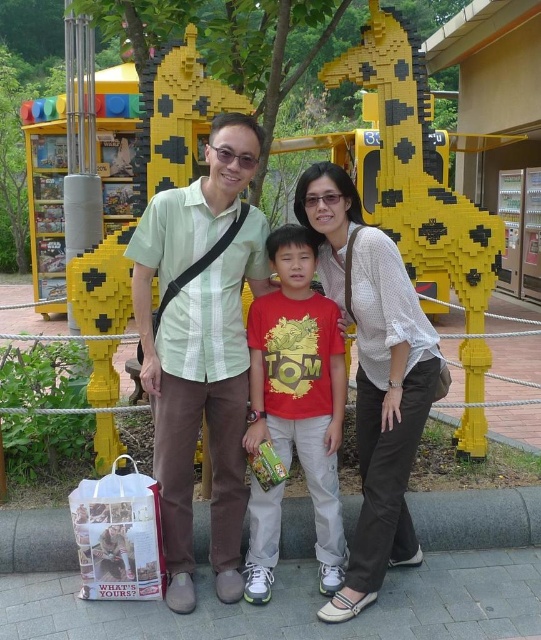
Consider the image. Which is more to the left, white dotted shirt at center or red matte shirt at center?

red matte shirt at center is more to the left.

Does white dotted shirt at center have a larger size compared to red matte shirt at center?

Indeed, white dotted shirt at center has a larger size compared to red matte shirt at center.

The width and height of the screenshot is (541, 640). Identify the location of white dotted shirt at center. click(373, 376).

The width and height of the screenshot is (541, 640). Find the location of `white dotted shirt at center`. white dotted shirt at center is located at coordinates (373, 376).

Describe the element at coordinates (372, 372) in the screenshot. I see `matte green shirt at center` at that location.

Which is behind, point (378, 417) or point (406, 436)?

Point (378, 417)

Based on the photo, who is more forward, (398, 440) or (359, 420)?

Point (398, 440)

I want to click on matte green shirt at center, so click(x=372, y=372).

Who is higher up, green striped shirt at center or matte green shirt at center?

green striped shirt at center is above.

Who is more distant from viewer, (148, 250) or (254, 579)?

The point (254, 579) is more distant.

Does point (161, 280) come farther from viewer compared to point (374, 477)?

Yes, point (161, 280) is farther from viewer.

I want to click on green striped shirt at center, so click(x=201, y=348).